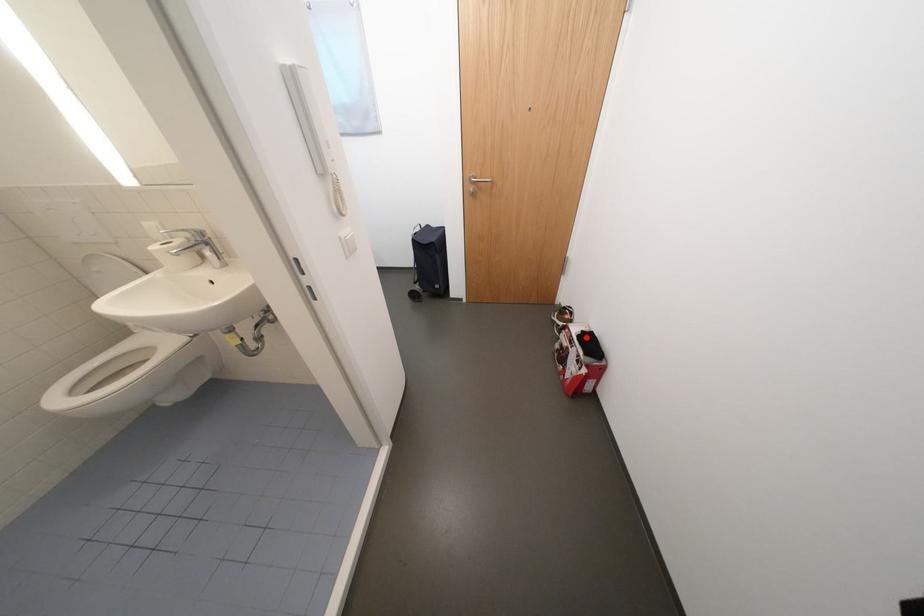
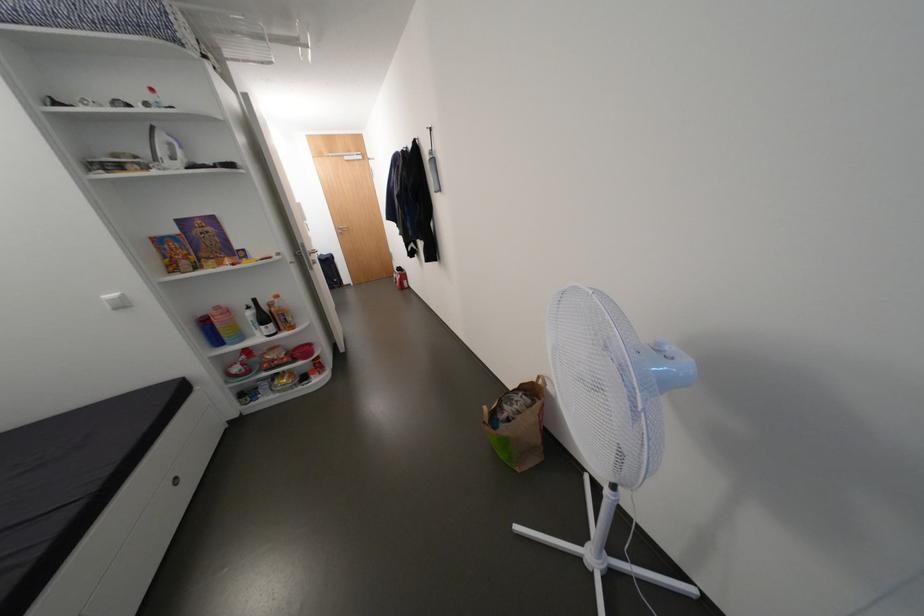
Question: I am providing you with two images of the same scene from different viewpoints. Image1 has a red point marked. In image2, the corresponding 3D location appears at what relative position? Reply with the corresponding letter.

Choices:
 (A) Closer
 (B) Farther

Answer: (B)